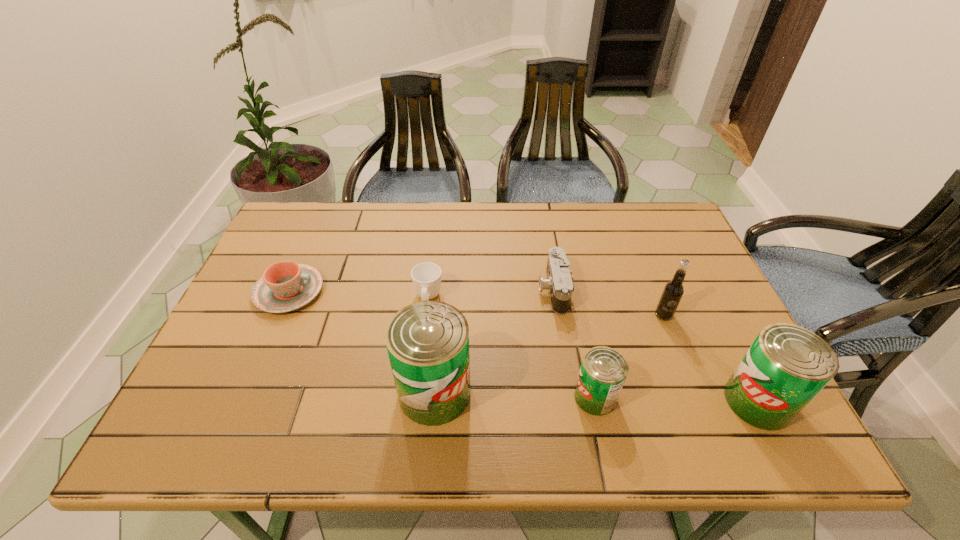
Where is `free space that is in between the leftmost can and the shortest can`? The width and height of the screenshot is (960, 540). free space that is in between the leftmost can and the shortest can is located at coordinates (515, 395).

Where is `free point between the second object from right to left and the cup`? This screenshot has width=960, height=540. free point between the second object from right to left and the cup is located at coordinates (545, 307).

This screenshot has width=960, height=540. I want to click on vacant area between the chinaware and the root beer, so click(476, 303).

Where is `empty location between the sixth object from left to right and the leftmost can`? empty location between the sixth object from left to right and the leftmost can is located at coordinates (549, 354).

Find the location of a particular element. This screenshot has width=960, height=540. object that can be found as the fifth closest to the cup is located at coordinates (672, 293).

Choose which object is the second nearest neighbor to the second object from right to left. Please provide its 2D coordinates. Your answer should be formatted as a tuple, i.e. [(x, y)], where the tuple contains the x and y coordinates of a point satisfying the conditions above.

[(559, 284)]

Locate an element on the screen. The height and width of the screenshot is (540, 960). can that is the third closest to the camera is located at coordinates (787, 365).

Where is `can that is the second nearest to the rightmost object`? can that is the second nearest to the rightmost object is located at coordinates (427, 342).

Image resolution: width=960 pixels, height=540 pixels. What are the coordinates of `vacant position in the image that satisfies the following two spatial constraints: 1. on the lens of the camera; 2. on the back side of the rightmost object` in the screenshot? It's located at pyautogui.click(x=572, y=401).

I want to click on free location that satisfies the following two spatial constraints: 1. on the handle side of the leftmost can; 2. on the right side of the chinaware, so click(245, 393).